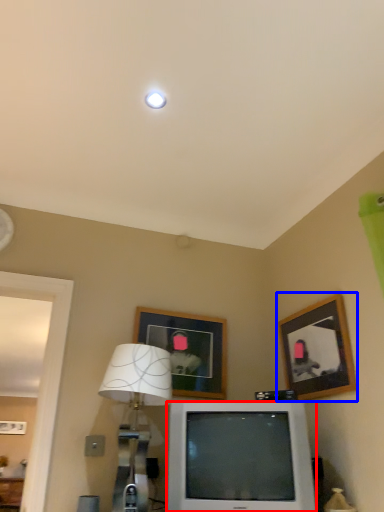
Question: Which object appears farthest to the camera in this image, television (highlighted by a red box) or picture frame (highlighted by a blue box)?

Choices:
 (A) television
 (B) picture frame

Answer: (B)